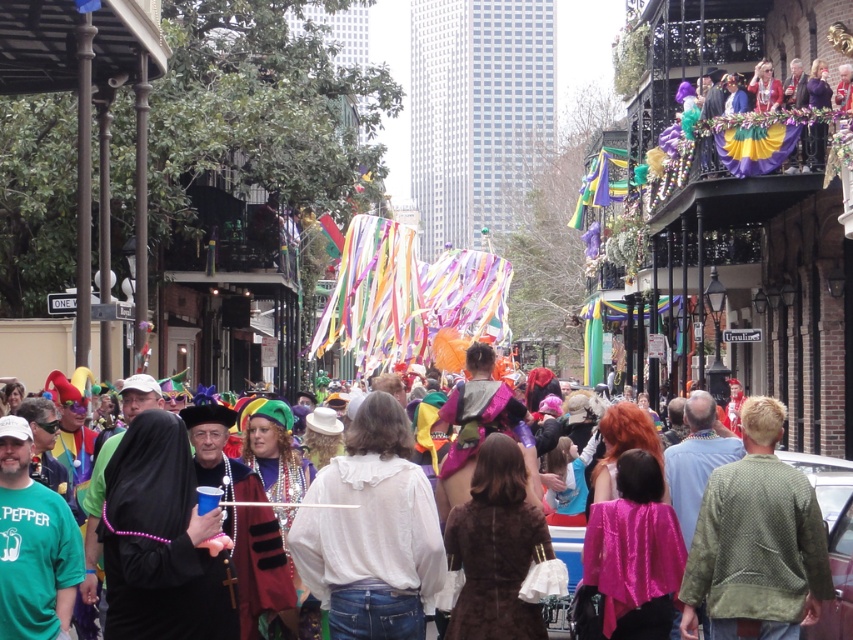
Question: Which of these objects is positioned closest to the camouflage-patterned jacket at center-right?

Choices:
 (A) shiny plastic cup at center
 (B) white cotton shirt at center

Answer: (A)

Question: Does camouflage-patterned jacket at center-right have a lesser width compared to shiny plastic cup at center?

Choices:
 (A) yes
 (B) no

Answer: (A)

Question: Is white cotton shirt at center below shiny plastic cup at center?

Choices:
 (A) no
 (B) yes

Answer: (B)

Question: Is white cotton shirt at center to the right of shiny plastic cup at center from the viewer's perspective?

Choices:
 (A) no
 (B) yes

Answer: (A)

Question: Which object is positioned farthest from the camouflage-patterned jacket at center-right?

Choices:
 (A) white cotton shirt at center
 (B) shiny plastic cup at center

Answer: (A)

Question: Among these points, which one is nearest to the camera?

Choices:
 (A) (679, 497)
 (B) (793, 570)

Answer: (B)